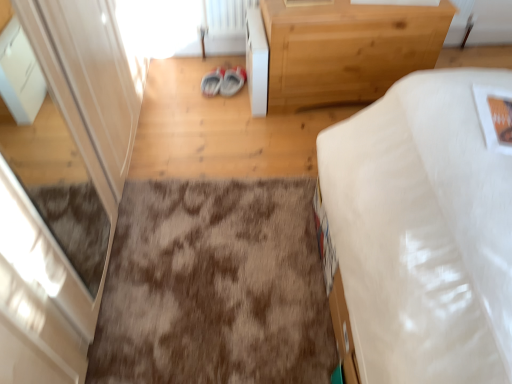
Where is `vacant area that is situated to the right of matte gray sneakers at center`? The width and height of the screenshot is (512, 384). vacant area that is situated to the right of matte gray sneakers at center is located at coordinates (229, 79).